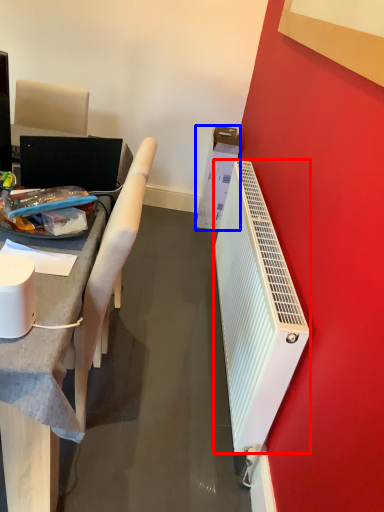
Question: Which point is closer to the camera, radiator (highlighted by a red box) or box (highlighted by a blue box)?

Choices:
 (A) radiator
 (B) box

Answer: (A)